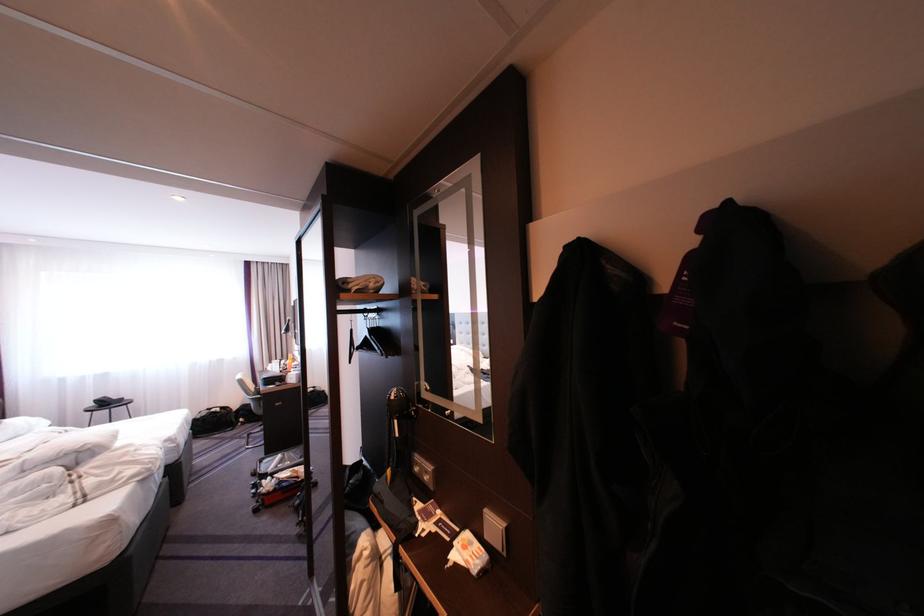
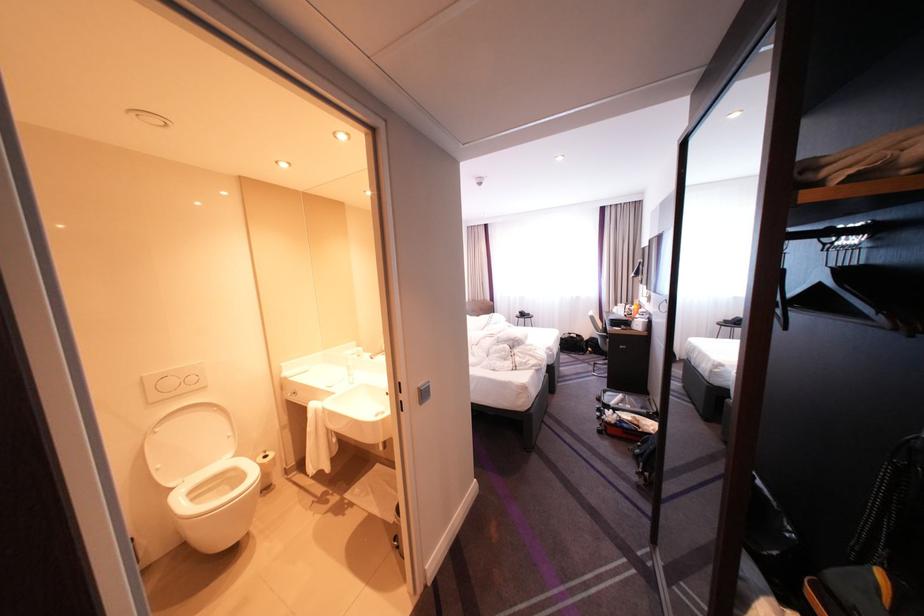
Where in the second image is the point corresponding to point (247, 408) from the first image?

(599, 338)